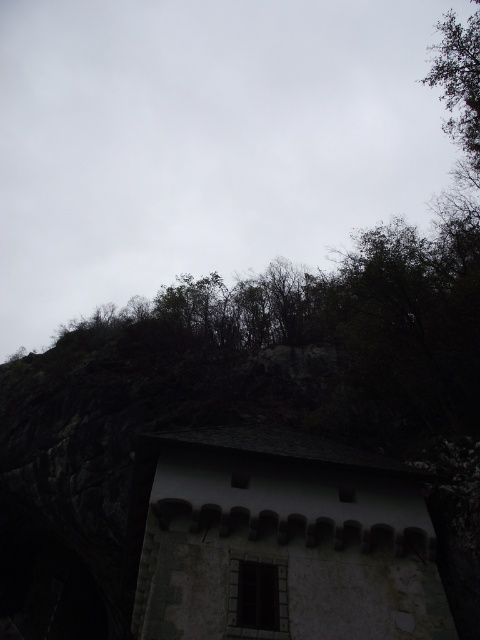
You are standing in front of the old building and want to reach the two points marked on the map. Which point, point (214,548) or point (314,452), is closer to you?

Point (214,548) is closer to you because it is in front of point (314,452).

You are a hiker who has spotted the white stone hut at center and the gray slate roof at upper center from a distance. Which structure would appear bigger to you when viewed from this distance?

The white stone hut at center appears bigger than the gray slate roof at upper center because it is larger in size.